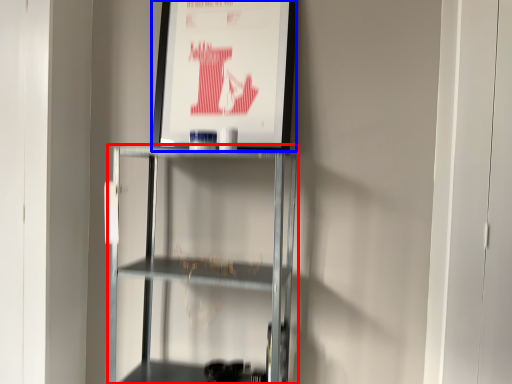
Question: Which point is closer to the camera, shelf (highlighted by a red box) or poster page (highlighted by a blue box)?

Choices:
 (A) shelf
 (B) poster page

Answer: (A)